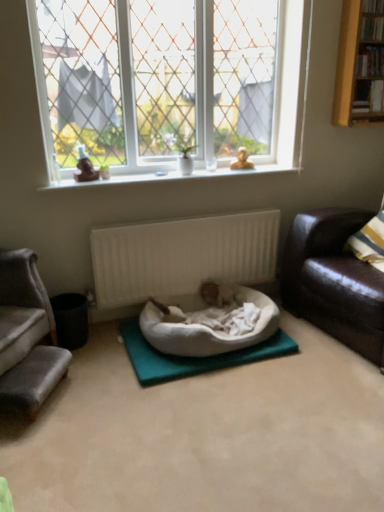
At what (x,y) coordinates should I click in order to perform the action: click on free point below black matte trash bin at lower left (from a real-world perspective). Please return your answer as a coordinate pair (x, y). Looking at the image, I should click on (87, 339).